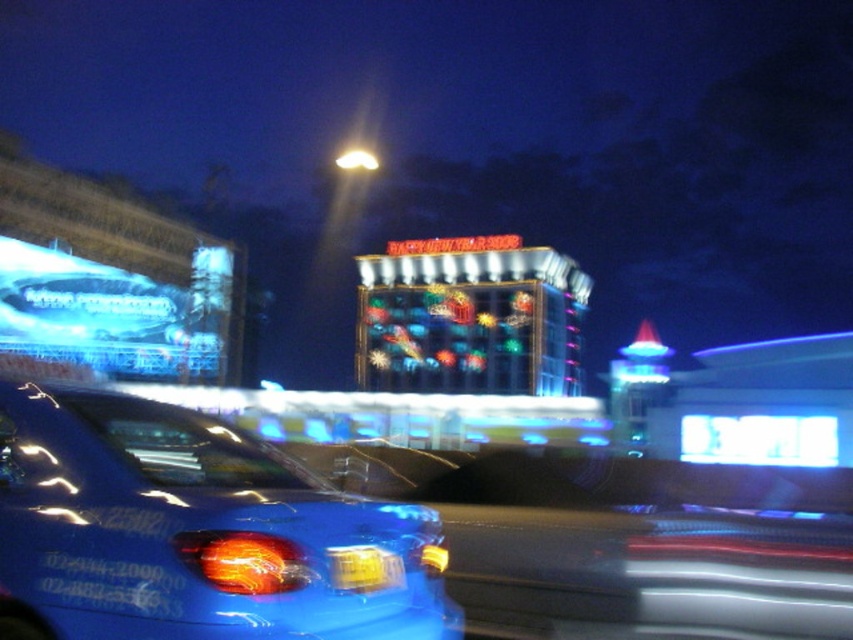
Is the position of glossy blue car at lower left less distant than that of yellow plastic license plate at center?

Yes.

Looking at this image, does glossy blue car at lower left have a larger size compared to yellow plastic license plate at center?

Yes, glossy blue car at lower left is bigger than yellow plastic license plate at center.

Between point (276, 524) and point (334, 577), which one is positioned in front?

Point (334, 577)

Identify the location of glossy blue car at lower left. (192, 529).